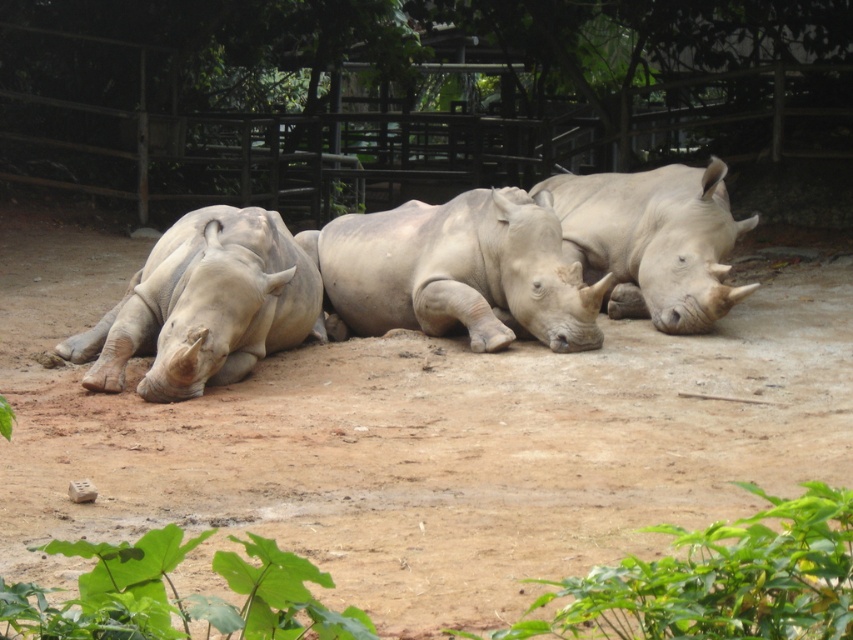
You are a zookeeper standing at the entrance of the enclosure. You need to approach the gray matte rhinoceros at center to check on its health. The safety guidelines state that you must stay at least 30 feet away from the rhinoceros at all times. Can you safely approach it without violating the guidelines?

The gray matte rhinoceros at center is currently 30.32 feet away from you. Since the safety guideline requires staying at least 30 feet away, you can approach slightly closer but must not go beyond the 30 feet limit to comply with the guidelines.

You are a zookeeper standing at the center of the enclosure. You need to approach the gray matte rhinoceros at left. Based on its 2D coordinates, in which direction should you move from your current position?

The gray matte rhinoceros at left is located at coordinates 0.478 on the x axis and 0.240 on the y axis. Since you are at the center, you should move towards the left and forward to reach it.